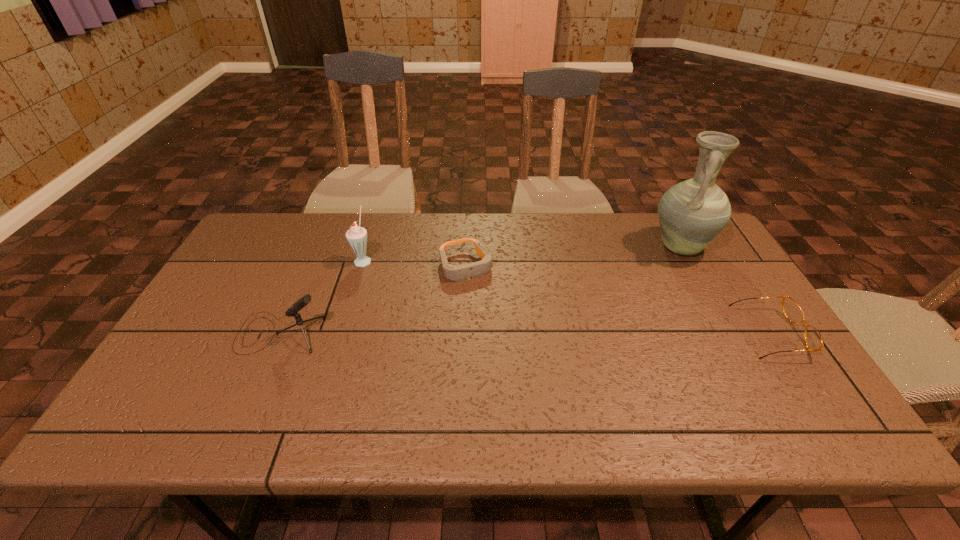
Where is `blank region between the second tallest object and the microphone`? This screenshot has height=540, width=960. blank region between the second tallest object and the microphone is located at coordinates (322, 296).

Locate an element on the screen. vacant point located between the spectacles and the fourth object from right to left is located at coordinates (567, 296).

Where is `vacant area that lies between the spectacles and the leftmost object`? vacant area that lies between the spectacles and the leftmost object is located at coordinates (x=526, y=333).

The height and width of the screenshot is (540, 960). Find the location of `free space between the leftmost object and the tallest object`. free space between the leftmost object and the tallest object is located at coordinates (481, 289).

The width and height of the screenshot is (960, 540). In order to click on empty space between the milkshake and the third tallest object in this screenshot , I will do `click(322, 296)`.

The width and height of the screenshot is (960, 540). In order to click on vacant region between the third shortest object and the third object from right to left in this screenshot , I will do `click(373, 299)`.

The image size is (960, 540). Identify the location of vacant area that lies between the third tallest object and the second tallest object. (322, 296).

This screenshot has height=540, width=960. Find the location of `vacant space that is in between the fourth object from right to left and the pitcher`. vacant space that is in between the fourth object from right to left and the pitcher is located at coordinates (522, 253).

In order to click on empty space that is in between the fourth object from right to left and the third object from right to left in this screenshot , I will do `click(415, 262)`.

Identify the location of blank region between the leftmost object and the second tallest object. (322, 296).